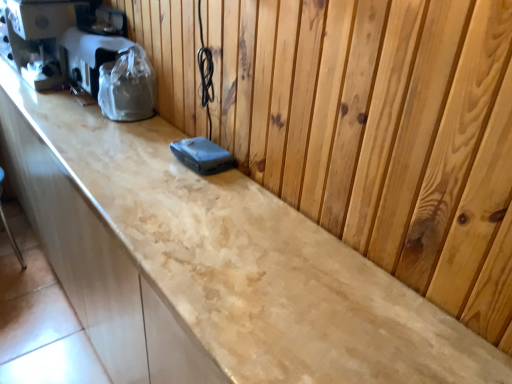
The width and height of the screenshot is (512, 384). In order to click on plastic-wrapped appliance at left in this screenshot , I will do `click(90, 56)`.

What do you see at coordinates (90, 56) in the screenshot? I see `plastic-wrapped appliance at left` at bounding box center [90, 56].

What is the approximate height of plastic-wrapped appliance at left?

The height of plastic-wrapped appliance at left is 10.18 inches.

Image resolution: width=512 pixels, height=384 pixels. What do you see at coordinates (38, 38) in the screenshot? I see `matte black coffee machine at left` at bounding box center [38, 38].

You are a GUI agent. You are given a task and a screenshot of the screen. Output one action in this format:
    pyautogui.click(x=<x>, y=<y>)
    Task: Click on the matte black coffee machine at left
    The height and width of the screenshot is (384, 512).
    Given the screenshot: What is the action you would take?
    pyautogui.click(x=38, y=38)

Where is `plastic-wrapped appliance at left`? This screenshot has height=384, width=512. plastic-wrapped appliance at left is located at coordinates (90, 56).

Can you confirm if plastic-wrapped appliance at left is positioned to the left of matte black coffee machine at left?

No.

Based on the photo, considering the positions of objects plastic-wrapped appliance at left and matte black coffee machine at left in the image provided, who is in front, plastic-wrapped appliance at left or matte black coffee machine at left?

Positioned in front is plastic-wrapped appliance at left.

Considering the points (64, 33) and (1, 46), which point is in front, point (64, 33) or point (1, 46)?

Positioned in front is point (64, 33).

From the image's perspective, which object appears higher, plastic-wrapped appliance at left or matte black coffee machine at left?

From the image's view, matte black coffee machine at left is above.

In the scene shown: From a real-world perspective, between plastic-wrapped appliance at left and matte black coffee machine at left, who is vertically higher?

matte black coffee machine at left is physically above.

Does plastic-wrapped appliance at left have a lesser width compared to matte black coffee machine at left?

Correct, the width of plastic-wrapped appliance at left is less than that of matte black coffee machine at left.

Considering the sizes of objects plastic-wrapped appliance at left and matte black coffee machine at left in the image provided, who is taller, plastic-wrapped appliance at left or matte black coffee machine at left?

matte black coffee machine at left is taller.

Considering the sizes of objects plastic-wrapped appliance at left and matte black coffee machine at left in the image provided, who is smaller, plastic-wrapped appliance at left or matte black coffee machine at left?

plastic-wrapped appliance at left is smaller.

Which is correct: plastic-wrapped appliance at left is inside matte black coffee machine at left, or outside of it?

The correct answer is: outside.

Is plastic-wrapped appliance at left next to matte black coffee machine at left and touching it?

plastic-wrapped appliance at left is not next to matte black coffee machine at left, and they're not touching.

Does plastic-wrapped appliance at left turn towards matte black coffee machine at left?

No, plastic-wrapped appliance at left is not oriented towards matte black coffee machine at left.

What's the angular difference between plastic-wrapped appliance at left and matte black coffee machine at left's facing directions?

There is a 0.799-degree angle between the facing directions of plastic-wrapped appliance at left and matte black coffee machine at left.

The width and height of the screenshot is (512, 384). Find the location of `coffee machine that is above the plastic-wrapped appliance at left (from the image's perspective)`. coffee machine that is above the plastic-wrapped appliance at left (from the image's perspective) is located at coordinates (38, 38).

Between matte black coffee machine at left and plastic-wrapped appliance at left, which one appears on the left side from the viewer's perspective?

matte black coffee machine at left.

Is matte black coffee machine at left behind plastic-wrapped appliance at left?

That is True.

Considering the points (55, 57) and (100, 46), which point is behind, point (55, 57) or point (100, 46)?

The point (55, 57) is more distant.

From the image's perspective, is matte black coffee machine at left located above or below plastic-wrapped appliance at left?

matte black coffee machine at left is above plastic-wrapped appliance at left.

From a real-world perspective, does matte black coffee machine at left stand above plastic-wrapped appliance at left?

Correct, in the physical world, matte black coffee machine at left is higher than plastic-wrapped appliance at left.

Which of these two, matte black coffee machine at left or plastic-wrapped appliance at left, is wider?

matte black coffee machine at left is wider.

Is matte black coffee machine at left shorter than plastic-wrapped appliance at left?

Incorrect, the height of matte black coffee machine at left does not fall short of that of plastic-wrapped appliance at left.

Is matte black coffee machine at left bigger than plastic-wrapped appliance at left?

Indeed, matte black coffee machine at left has a larger size compared to plastic-wrapped appliance at left.

Would you say matte black coffee machine at left is outside plastic-wrapped appliance at left?

Absolutely, matte black coffee machine at left is external to plastic-wrapped appliance at left.

Is matte black coffee machine at left far from plastic-wrapped appliance at left?

That's not correct — matte black coffee machine at left is a little close to plastic-wrapped appliance at left.

Is matte black coffee machine at left looking in the opposite direction of plastic-wrapped appliance at left?

matte black coffee machine at left does not have its back to plastic-wrapped appliance at left.

Image resolution: width=512 pixels, height=384 pixels. I want to click on coffee machine that appears on the left of plastic-wrapped appliance at left, so click(x=38, y=38).

Identify the location of appliance on the right of matte black coffee machine at left. [x=90, y=56].

Find the location of a particular element. appliance in front of the matte black coffee machine at left is located at coordinates (90, 56).